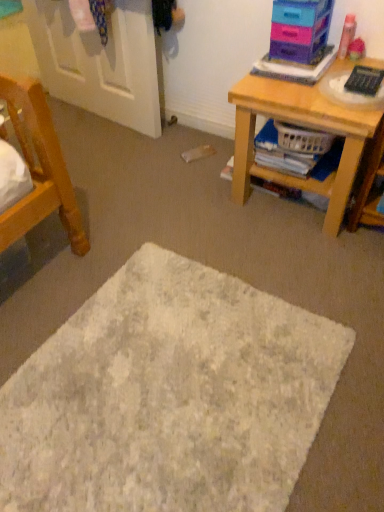
At what (x,y) coordinates should I click in order to perform the action: click on vacant space underneath white painted wood door at upper left (from a real-world perspective). Please return your answer as a coordinate pair (x, y). The width and height of the screenshot is (384, 512). Looking at the image, I should click on (98, 119).